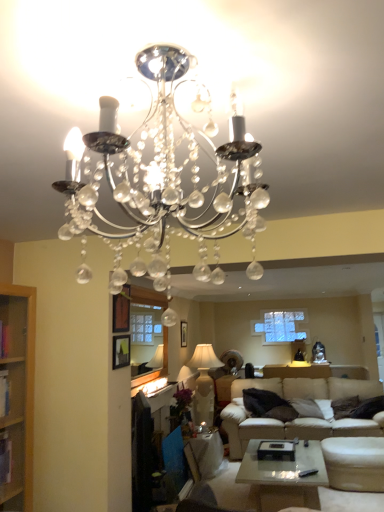
Question: Is clear crystal chandelier at upper center, acting as the first lamp starting from the top, bigger than matte white side table at lower center?

Choices:
 (A) no
 (B) yes

Answer: (A)

Question: Does clear crystal chandelier at upper center, positioned as the first lamp in front-to-back order, turn towards matte white side table at lower center?

Choices:
 (A) yes
 (B) no

Answer: (B)

Question: From the image's perspective, is clear crystal chandelier at upper center, acting as the first lamp starting from the top, located beneath matte white side table at lower center?

Choices:
 (A) yes
 (B) no

Answer: (B)

Question: Is clear crystal chandelier at upper center, positioned as the second lamp in back-to-front order, in front of matte white side table at lower center?

Choices:
 (A) no
 (B) yes

Answer: (B)

Question: From a real-world perspective, is clear crystal chandelier at upper center, positioned as the first lamp in front-to-back order, physically above matte white side table at lower center?

Choices:
 (A) no
 (B) yes

Answer: (B)

Question: Is clear crystal chandelier at upper center, acting as the first lamp starting from the top, turned away from matte white side table at lower center?

Choices:
 (A) no
 (B) yes

Answer: (A)

Question: From a real-world perspective, does clear crystal chandelier at upper center, positioned as the first lamp in front-to-back order, sit lower than white fabric lampshade at center, which is counted as the second lamp, starting from the front?

Choices:
 (A) no
 (B) yes

Answer: (A)

Question: Is clear crystal chandelier at upper center, positioned as the second lamp in back-to-front order, directly adjacent to white fabric lampshade at center, marked as the 1th lamp in a back-to-front arrangement?

Choices:
 (A) no
 (B) yes

Answer: (A)

Question: From the image's perspective, is clear crystal chandelier at upper center, the second lamp from the bottom, on white fabric lampshade at center, positioned as the 1th lamp in bottom-to-top order?

Choices:
 (A) no
 (B) yes

Answer: (B)

Question: Is clear crystal chandelier at upper center, acting as the first lamp starting from the top, wider than white fabric lampshade at center, marked as the 1th lamp in a back-to-front arrangement?

Choices:
 (A) no
 (B) yes

Answer: (B)

Question: Is clear crystal chandelier at upper center, positioned as the first lamp in front-to-back order, in front of white fabric lampshade at center, which is counted as the second lamp, starting from the front?

Choices:
 (A) yes
 (B) no

Answer: (A)

Question: Can you confirm if clear crystal chandelier at upper center, positioned as the second lamp in back-to-front order, is positioned to the right of white fabric lampshade at center, positioned as the 1th lamp in bottom-to-top order?

Choices:
 (A) no
 (B) yes

Answer: (A)

Question: From the image's perspective, does white fabric lampshade at center, positioned as the 1th lamp in bottom-to-top order, appear lower than clear glass window screen at center?

Choices:
 (A) no
 (B) yes

Answer: (B)